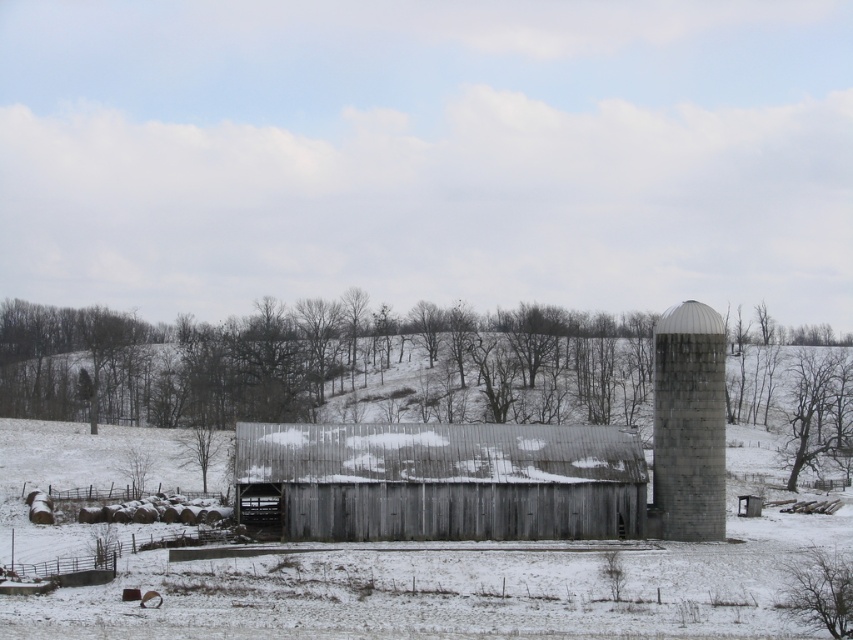
You are standing in the middle of the snowy field looking at the barn and silo. There are two points marked in the image. Which point is closer to you, point 1 at coordinates (370,442) or point 2 at coordinates (685,403)?

Point 2 at coordinates (685,403) is closer to you because it is nearer to the camera than point 1 at coordinates (370,442).

You are a farmer checking the dimensions of your property. You need to know which structure is bigger between the weathered wood barn at center and the gray concrete silo at right. Can you tell me which one is larger?

The weathered wood barn at center has a larger size compared to gray concrete silo at right, so the weathered wood barn at center is bigger.

You are planning to build a fence around both the weathered wood barn at center and the gray concrete silo at right. Based on their sizes, which one requires a longer fence to enclose it?

The weathered wood barn at center requires a longer fence because its width is larger than the gray concrete silo at right, meaning it has a greater overall size.